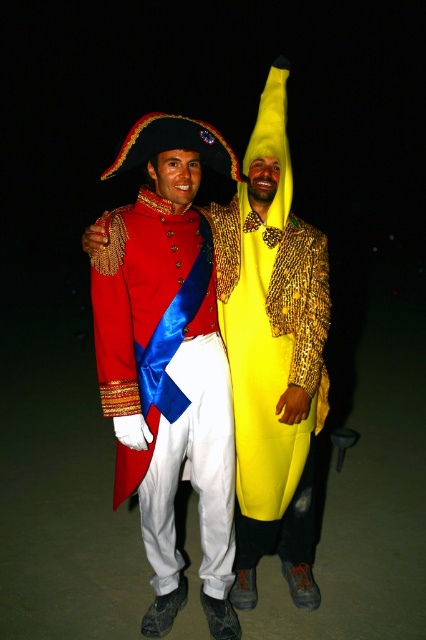
Who is more distant from viewer, (232, 508) or (268, 248)?

Positioned behind is point (268, 248).

Which is in front, point (187, 394) or point (273, 154)?

Point (187, 394) is in front.

What do you see at coordinates (167, 362) in the screenshot? I see `shiny red coat at center` at bounding box center [167, 362].

Locate an element on the screen. The width and height of the screenshot is (426, 640). shiny red coat at center is located at coordinates (167, 362).